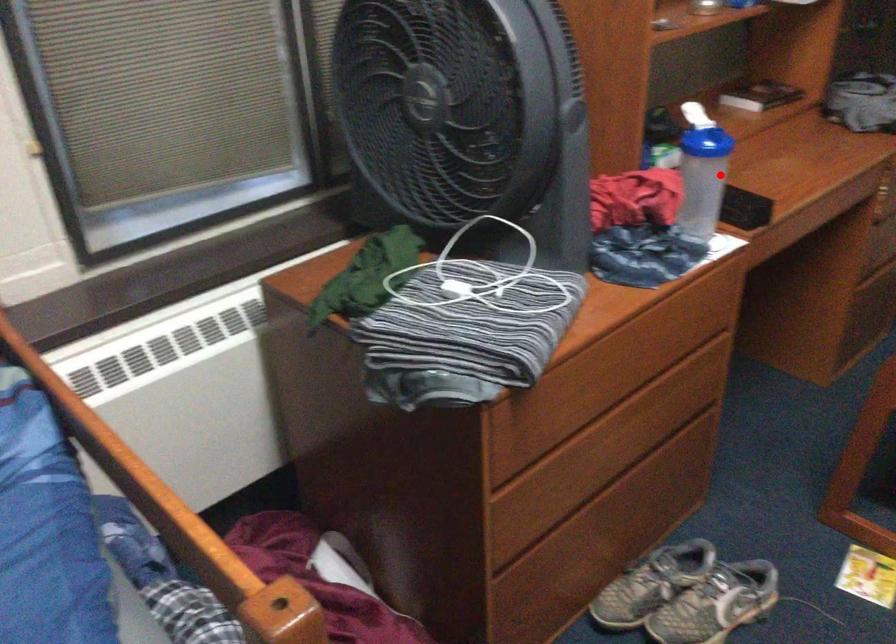
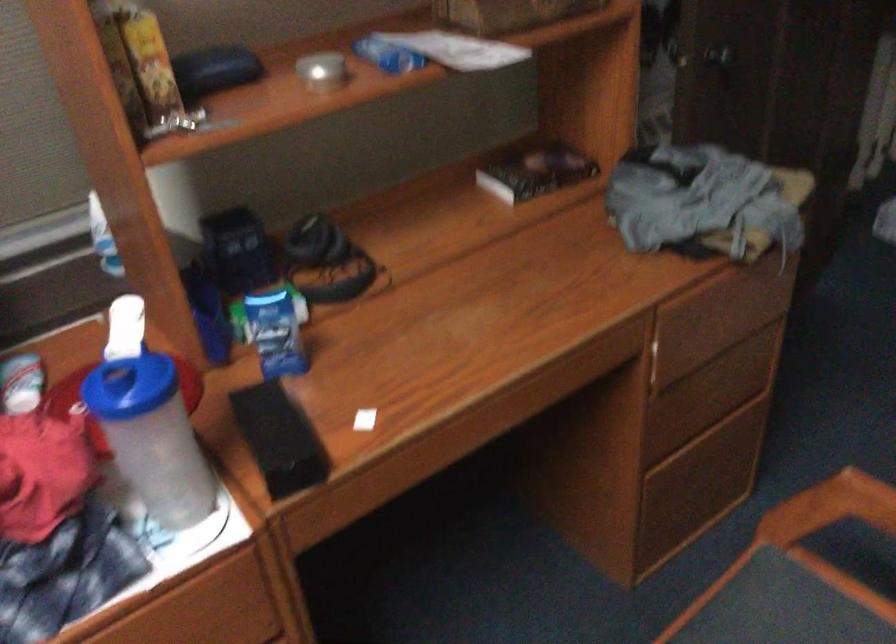
Locate, in the second image, the point that corresponds to the highlighted location in the first image.

(151, 437)